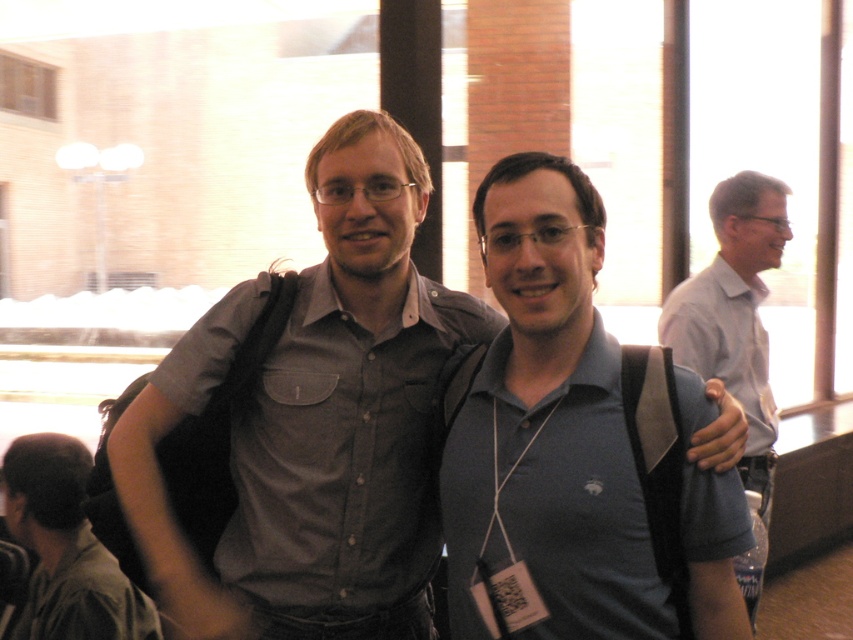
You are standing in the room where the two people are. You need to hand a document to the person wearing the matte gray shirt at center. To avoid confusion, which direction should you walk relative to the gray shirt at right?

The matte gray shirt at center is located below the gray shirt at right, so you should walk downward towards the matte gray shirt at center relative to the gray shirt at right.

You are standing in the room and want to walk from point A to point B. The coordinates for point A are point (113, 445) and point B are point (764, 358). Given that there are no obstacles between them, will you pass in front of the person wearing the light blue polo shirt during your journey?

Point (113, 445) is in front of point (764, 358), so yes, you will pass in front of the person wearing the light blue polo shirt during your journey.

You are a photographer trying to capture a photo of both the blue fabric shirt at center and the gray shirt at right. Based on their positions, which one should you focus on first to ensure both are in frame?

The blue fabric shirt at center is located below the gray shirt at right, so you should focus on the gray shirt at right first to ensure both are in frame.